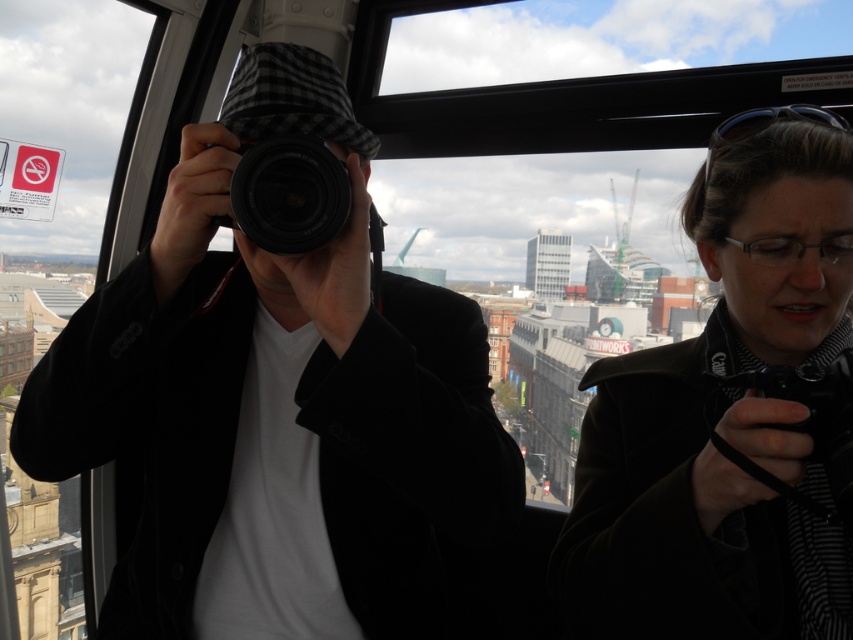
Question: Among these points, which one is nearest to the camera?

Choices:
 (A) (61, 600)
 (B) (825, 602)

Answer: (B)

Question: Where is black plastic camera at center located in relation to black plastic goggles at upper right in the image?

Choices:
 (A) right
 (B) left

Answer: (B)

Question: Which point appears farthest from the camera in this image?

Choices:
 (A) (68, 577)
 (B) (706, 156)

Answer: (A)

Question: Can you confirm if matte black camera at center is bigger than black plastic goggles at upper right?

Choices:
 (A) no
 (B) yes

Answer: (B)

Question: Which of the following is the closest to the observer?

Choices:
 (A) matte black camera at right
 (B) transparent glass window at lower left
 (C) black plastic camera at center
 (D) matte black camera at center

Answer: (A)

Question: Does matte black camera at right appear on the right side of black plastic goggles at upper right?

Choices:
 (A) no
 (B) yes

Answer: (A)